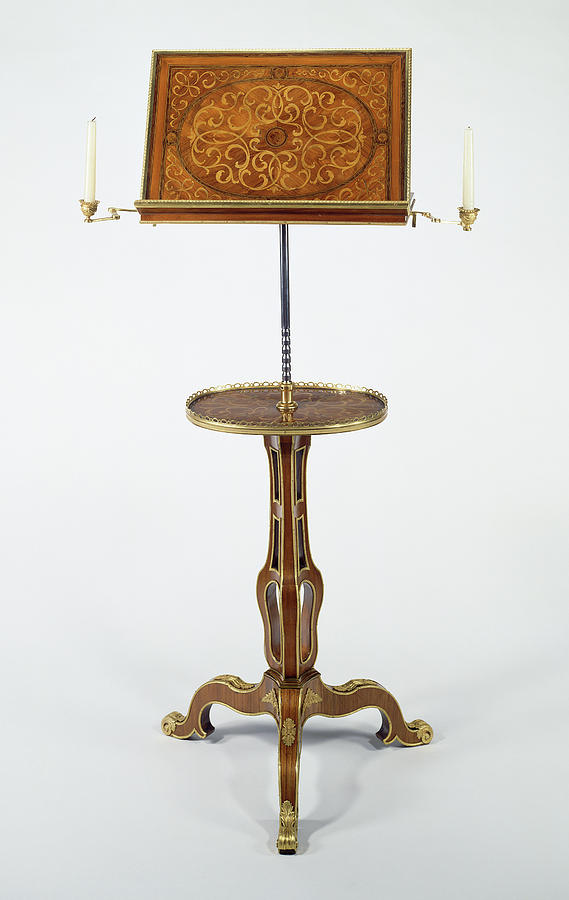
What are the coordinates of `candles` in the screenshot? It's located at (465, 159), (88, 150).